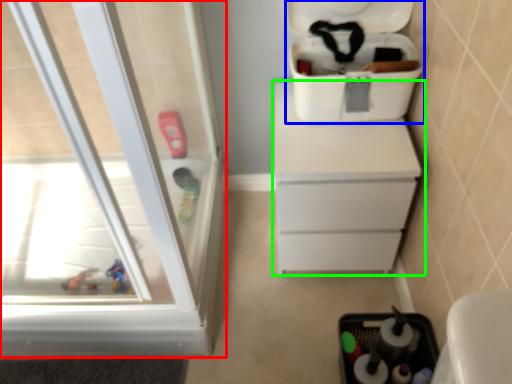
Question: Which is farther away from screen door (highlighted by a red box)? cooler (highlighted by a blue box) or chest of drawers (highlighted by a green box)?

Choices:
 (A) cooler
 (B) chest of drawers

Answer: (A)